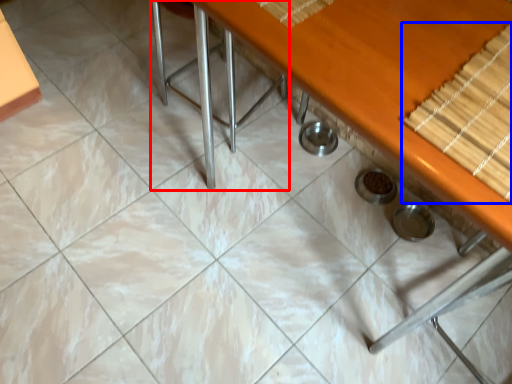
Question: Which object is closer to the camera taking this photo, chair (highlighted by a red box) or wood (highlighted by a blue box)?

Choices:
 (A) chair
 (B) wood

Answer: (B)